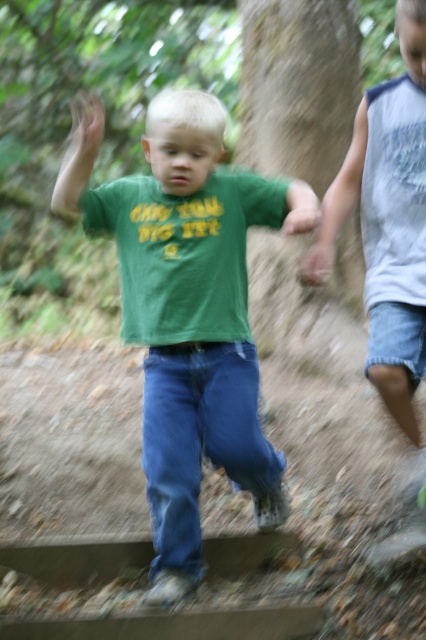
You are a photographer adjusting your camera to focus on two points in the image. The first point is point (244, 360) and the second point is point (405, 147). Which point is closer to your camera?

Point (244, 360) is further to the camera than point (405, 147), so the second point is closer to the camera.

Based on the scene description, which child is positioned lower in the image, the one wearing the green matte shirt at center or the gray sleeveless shirt at right?

The green matte shirt at center is positioned below the gray sleeveless shirt at right, so the child in the green matte shirt at center is lower in the image.